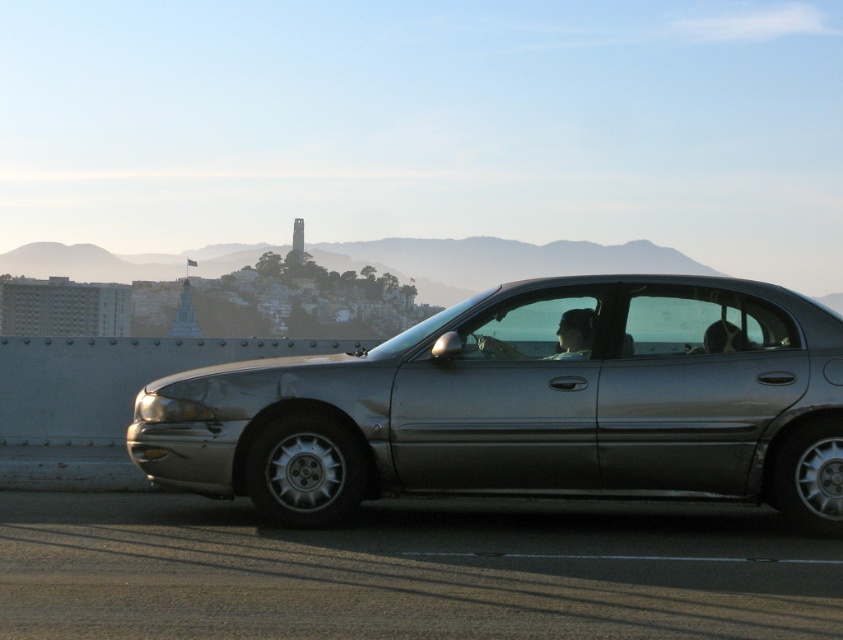
Question: Does satin silver sedan at center appear over smooth skin face at center?

Choices:
 (A) yes
 (B) no

Answer: (B)

Question: Is satin silver sedan at center wider than smooth skin face at center?

Choices:
 (A) no
 (B) yes

Answer: (B)

Question: Which of the following is the farthest from the observer?

Choices:
 (A) smooth skin face at center
 (B) satin silver sedan at center

Answer: (A)

Question: Which object appears farthest from the camera in this image?

Choices:
 (A) smooth skin face at center
 (B) satin silver sedan at center

Answer: (A)

Question: Which of the following is the farthest from the observer?

Choices:
 (A) (580, 326)
 (B) (213, 424)

Answer: (A)

Question: Does satin silver sedan at center have a larger size compared to smooth skin face at center?

Choices:
 (A) yes
 (B) no

Answer: (A)